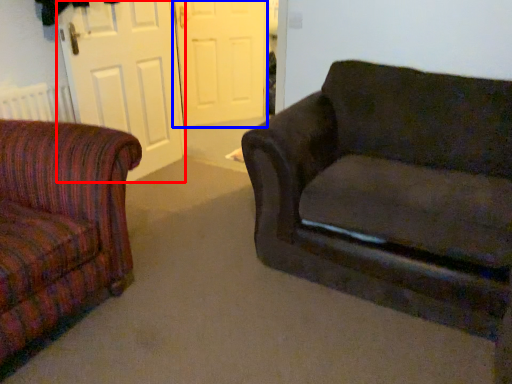
Question: Which object is further to the camera taking this photo, screen door (highlighted by a red box) or screen door (highlighted by a blue box)?

Choices:
 (A) screen door
 (B) screen door

Answer: (B)